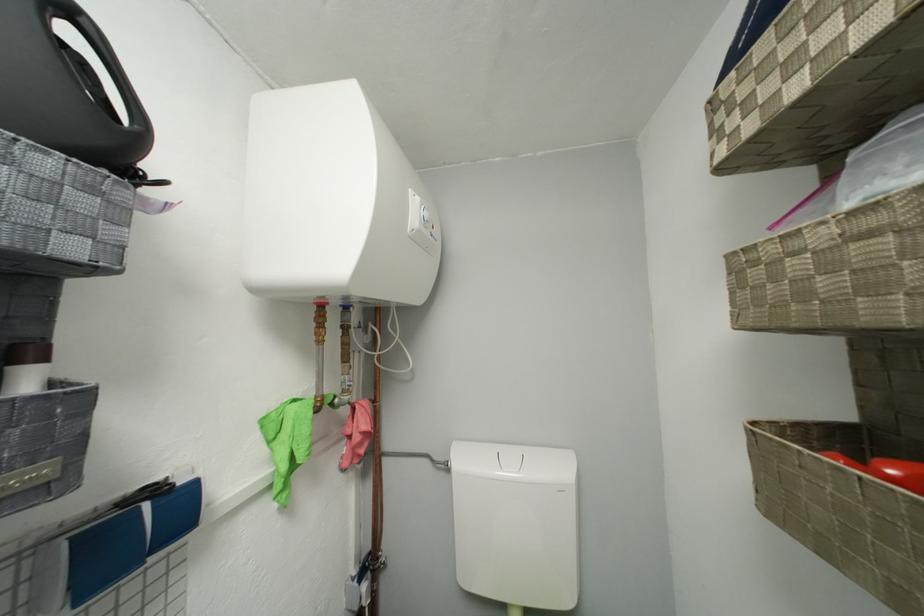
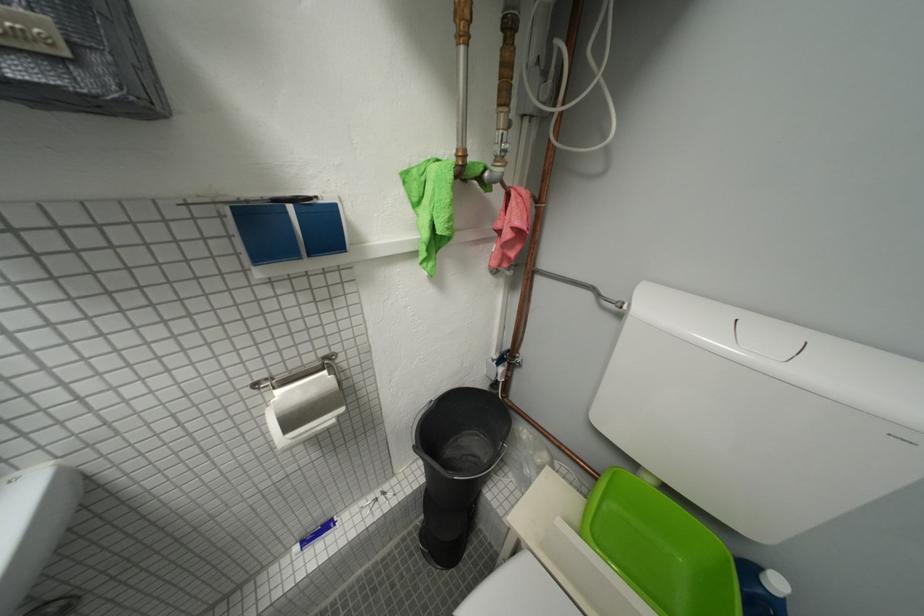
The images are taken continuously from a first-person perspective. In which direction is your viewpoint rotating?

The camera rotated toward left-down.